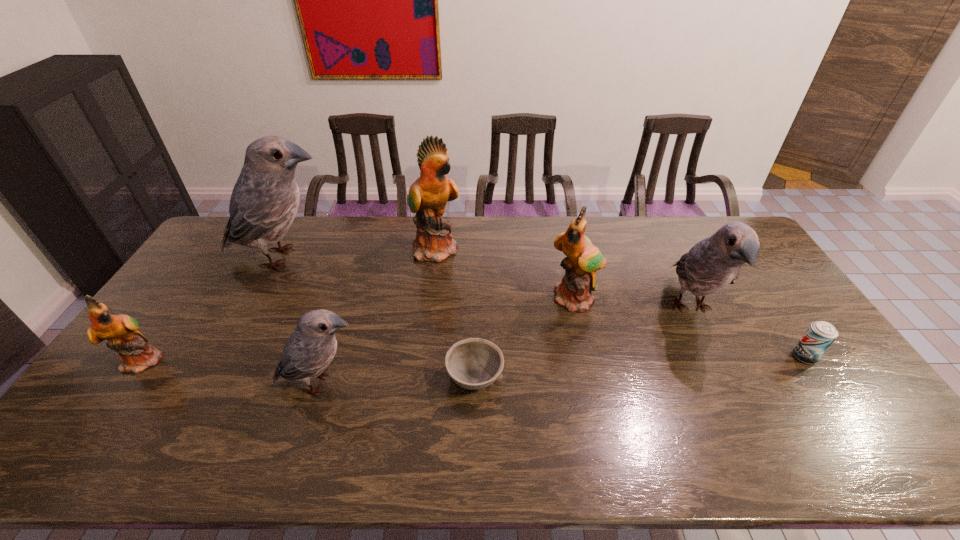
Where is `beer can`? The height and width of the screenshot is (540, 960). beer can is located at coordinates (820, 335).

The image size is (960, 540). I want to click on the rightmost object, so click(x=820, y=335).

This screenshot has height=540, width=960. Identify the location of bowl. (474, 363).

Image resolution: width=960 pixels, height=540 pixels. Find the location of `gray bowl`. gray bowl is located at coordinates (474, 363).

This screenshot has width=960, height=540. In order to click on blank space located 0.150m on the front-facing side of the biggest gray parrot in this screenshot , I will do `click(381, 258)`.

The height and width of the screenshot is (540, 960). I want to click on vacant region located 0.070m on the front-facing side of the farthest green parrot, so click(x=480, y=249).

The width and height of the screenshot is (960, 540). What are the coordinates of `free space located 0.270m on the front-facing side of the second biggest green parrot` in the screenshot? It's located at (596, 391).

The width and height of the screenshot is (960, 540). I want to click on blank space located 0.060m on the front-facing side of the second biggest gray parrot, so click(x=719, y=365).

The image size is (960, 540). I want to click on free space located on the front-facing side of the leftmost green parrot, so click(296, 360).

Locate an element on the screen. free space located 0.290m on the front-facing side of the smallest gray parrot is located at coordinates (474, 383).